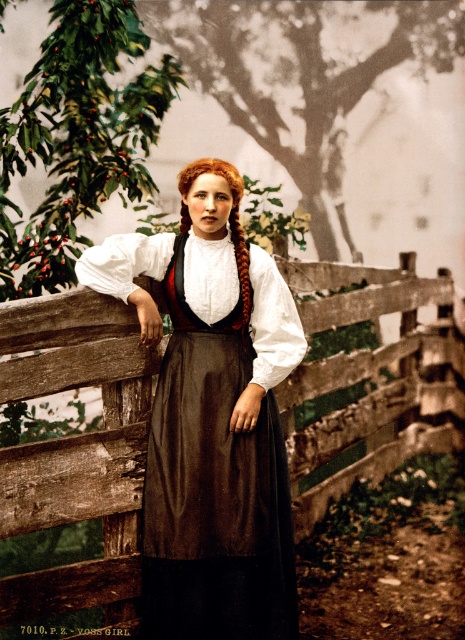
You are a photographer planning to take a portrait of the woman wearing the brown satin dress at center. To ensure the wooden fence at center is visible in the background, should you adjust your camera angle upwards or downwards?

The wooden fence at center is positioned under the brown satin dress at center, so to have the fence visible in the background behind the dress, you should angle your camera upwards.

You are a photographer setting up a shoot in this scene. You need to ensure that the wooden fence at center and the brown satin dress at center are both visible in the frame. Based on their heights, which object will appear taller in the photo?

The brown satin dress at center will appear taller in the photo because the wooden fence at center is shorter than it.